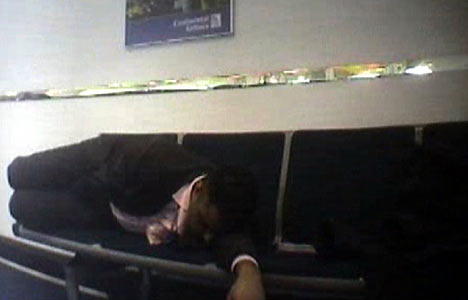
Image resolution: width=468 pixels, height=300 pixels. I want to click on bottom of poster, so click(x=194, y=17).